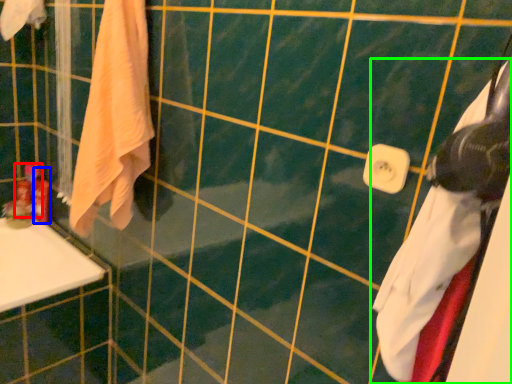
Question: Based on their relative distances, which object is nearer to toiletry (highlighted by a red box)? Choose from toiletry (highlighted by a blue box) and towel (highlighted by a green box).

Choices:
 (A) toiletry
 (B) towel

Answer: (A)